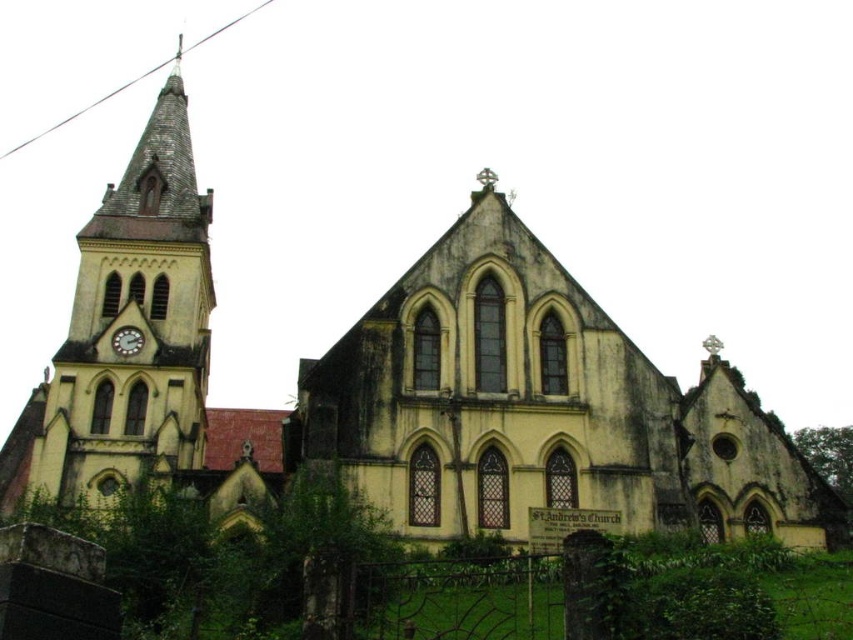
Question: Which point appears farthest from the camera in this image?

Choices:
 (A) (117, 333)
 (B) (195, 241)

Answer: (B)

Question: Can you confirm if yellow stone clock tower at left is bigger than metallic clock at left?

Choices:
 (A) yes
 (B) no

Answer: (A)

Question: Is yellow stone clock tower at left below metallic clock at left?

Choices:
 (A) yes
 (B) no

Answer: (B)

Question: Can you confirm if yellow stone clock tower at left is positioned above metallic clock at left?

Choices:
 (A) yes
 (B) no

Answer: (A)

Question: Which of the following is the closest to the observer?

Choices:
 (A) metallic clock at left
 (B) yellow stone clock tower at left

Answer: (B)

Question: Which point appears closest to the camera in this image?

Choices:
 (A) click(x=115, y=490)
 (B) click(x=131, y=333)

Answer: (A)